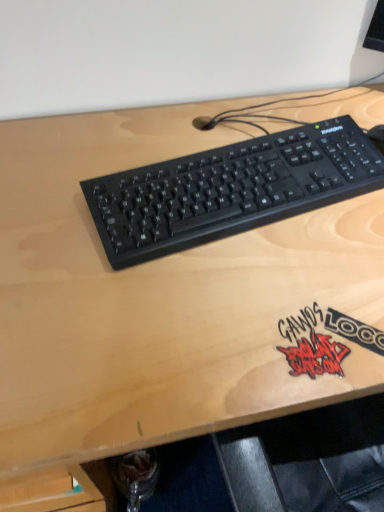
What are the coordinates of `free space above black matte keyboard at center (from a real-world perspective)` in the screenshot? It's located at (242, 168).